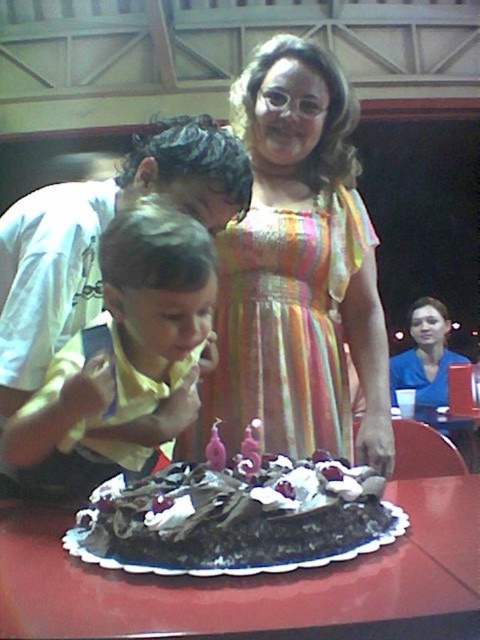
You are a photographer at the birthday party and want to capture a photo of the multicolored striped dress at center and the matte yellow shirt at left. Which one is closer to you?

The multicolored striped dress at center is closer to you than the matte yellow shirt at left.

You are a photographer at the birthday party. You want to capture a photo of the pink wax candle at center without the blue fabric shirt at center blocking it. Is it possible to do so based on their positions?

The pink wax candle at center is behind the blue fabric shirt at center, so it is blocked by the shirt and cannot be captured without the blue fabric shirt at center in the photo.

You are a photographer setting up for a birthday photo. You need to position the multicolored striped dress at center and the matte yellow shirt at left so that they are exactly 16 inches apart. Based on the current setup, do you need to move them closer or farther apart?

The current distance between the multicolored striped dress at center and the matte yellow shirt at left is 15.56 inches. To reach the desired 16 inches, you need to move them slightly farther apart.